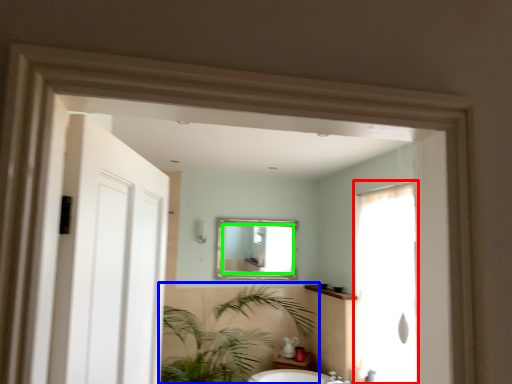
Question: Which object is positioned farthest from screen door (highlighted by a red box)? Select from houseplant (highlighted by a blue box) and mirror (highlighted by a green box).

Choices:
 (A) houseplant
 (B) mirror

Answer: (B)